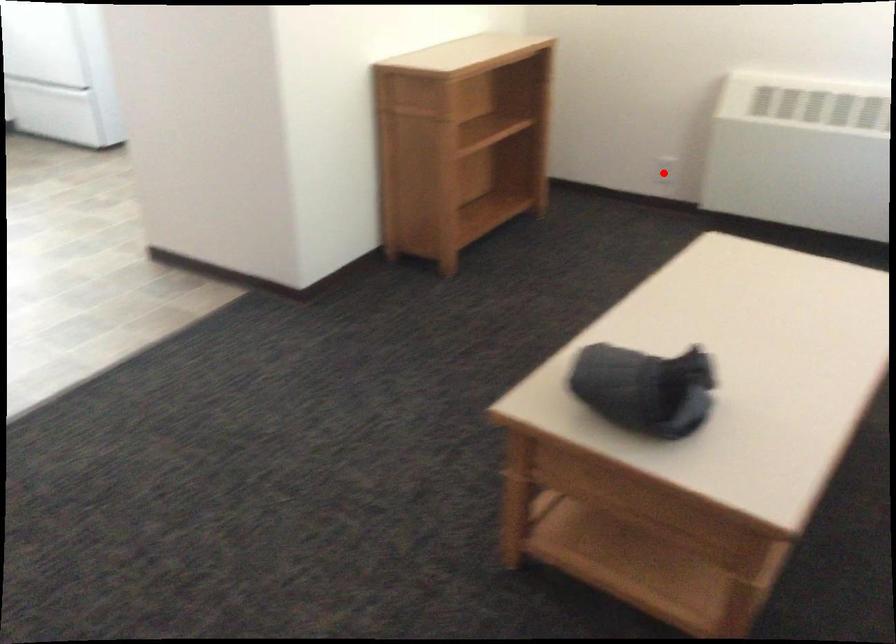
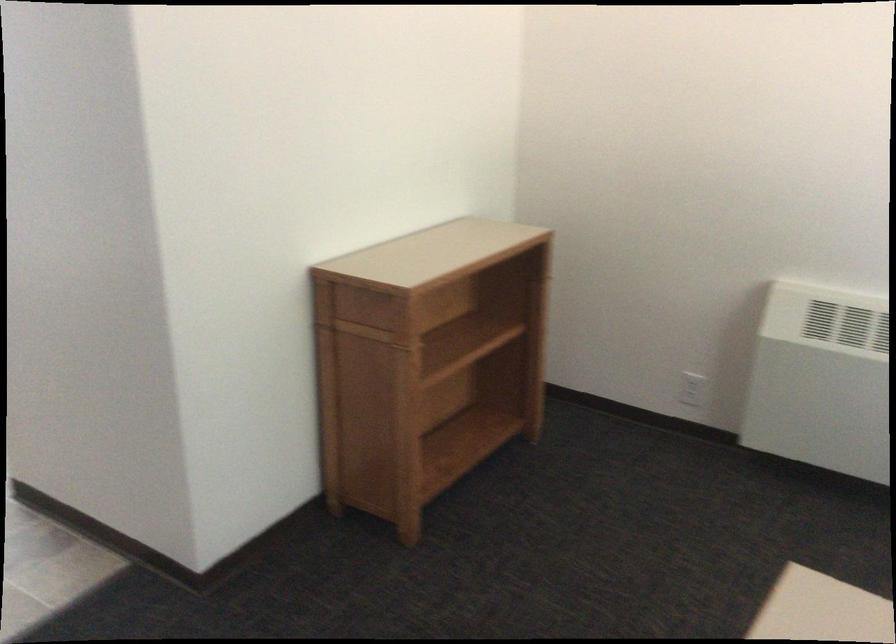
Find the pixel in the second image that matches the highlighted location in the first image.

(692, 389)